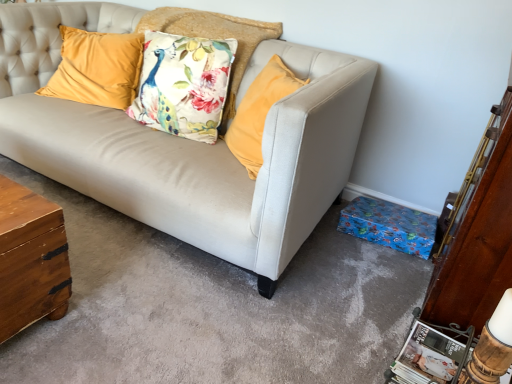
Question: Is floral fabric cushion at center, placed as the 2th pillow when sorted from left to right, located within velvet yellow pillow at upper left, marked as the 2th pillow in a right-to-left arrangement?

Choices:
 (A) yes
 (B) no

Answer: (B)

Question: Is velvet yellow pillow at upper left, the first pillow when ordered from left to right, looking in the opposite direction of floral fabric cushion at center, placed as the 2th pillow when sorted from left to right?

Choices:
 (A) yes
 (B) no

Answer: (B)

Question: Is velvet yellow pillow at upper left, marked as the 2th pillow in a right-to-left arrangement, with floral fabric cushion at center, which is the 1th pillow in right-to-left order?

Choices:
 (A) yes
 (B) no

Answer: (B)

Question: Could you tell me if velvet yellow pillow at upper left, the first pillow when ordered from left to right, is turned towards floral fabric cushion at center, placed as the 2th pillow when sorted from left to right?

Choices:
 (A) yes
 (B) no

Answer: (B)

Question: Does velvet yellow pillow at upper left, the first pillow when ordered from left to right, have a larger size compared to floral fabric cushion at center, placed as the 2th pillow when sorted from left to right?

Choices:
 (A) yes
 (B) no

Answer: (B)

Question: Is velvet yellow pillow at upper left, marked as the 2th pillow in a right-to-left arrangement, shorter than floral fabric cushion at center, placed as the 2th pillow when sorted from left to right?

Choices:
 (A) yes
 (B) no

Answer: (A)

Question: From the image's perspective, is floral fabric cushion at center, placed as the 2th pillow when sorted from left to right, located beneath velvet yellow pillow at upper left, the first pillow when ordered from left to right?

Choices:
 (A) no
 (B) yes

Answer: (A)

Question: Does floral fabric cushion at center, placed as the 2th pillow when sorted from left to right, have a greater height compared to velvet yellow pillow at upper left, the first pillow when ordered from left to right?

Choices:
 (A) no
 (B) yes

Answer: (B)

Question: Is floral fabric cushion at center, placed as the 2th pillow when sorted from left to right, facing towards velvet yellow pillow at upper left, the first pillow when ordered from left to right?

Choices:
 (A) no
 (B) yes

Answer: (A)

Question: Is floral fabric cushion at center, placed as the 2th pillow when sorted from left to right, shorter than velvet yellow pillow at upper left, marked as the 2th pillow in a right-to-left arrangement?

Choices:
 (A) no
 (B) yes

Answer: (A)

Question: From the image's perspective, is floral fabric cushion at center, which is the 1th pillow in right-to-left order, on top of velvet yellow pillow at upper left, the first pillow when ordered from left to right?

Choices:
 (A) yes
 (B) no

Answer: (A)

Question: From a real-world perspective, is floral fabric cushion at center, placed as the 2th pillow when sorted from left to right, beneath velvet yellow pillow at upper left, the first pillow when ordered from left to right?

Choices:
 (A) yes
 (B) no

Answer: (B)

Question: From a real-world perspective, is velvet yellow pillow at upper left, marked as the 2th pillow in a right-to-left arrangement, physically located above or below floral fabric cushion at center, placed as the 2th pillow when sorted from left to right?

Choices:
 (A) below
 (B) above

Answer: (A)